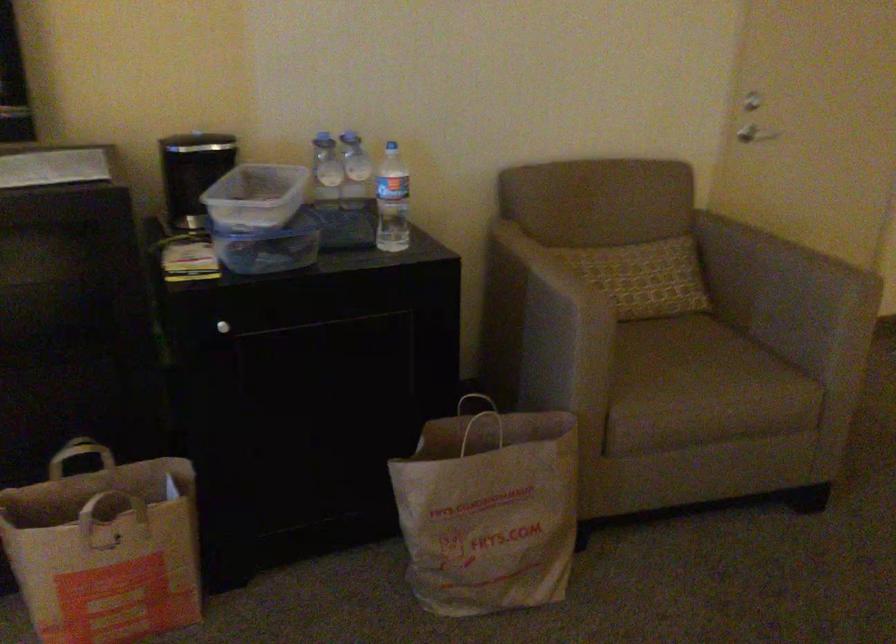
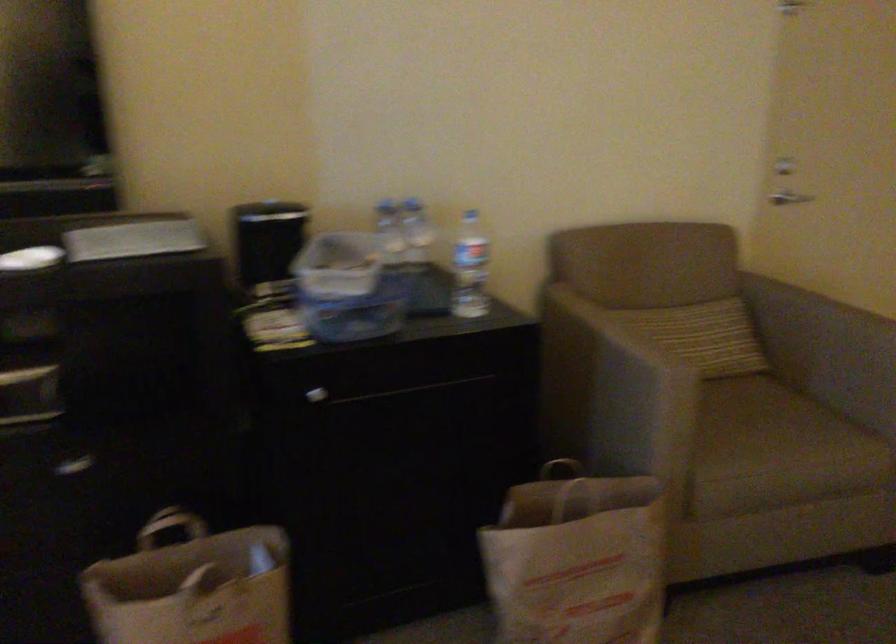
Find the pixel in the second image that matches the point at 389,202 in the first image.

(470, 268)